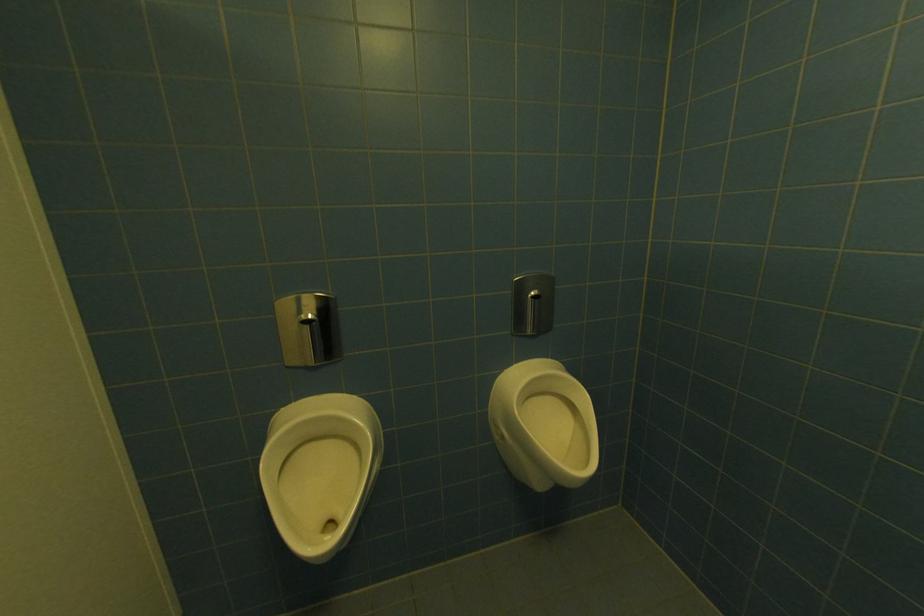
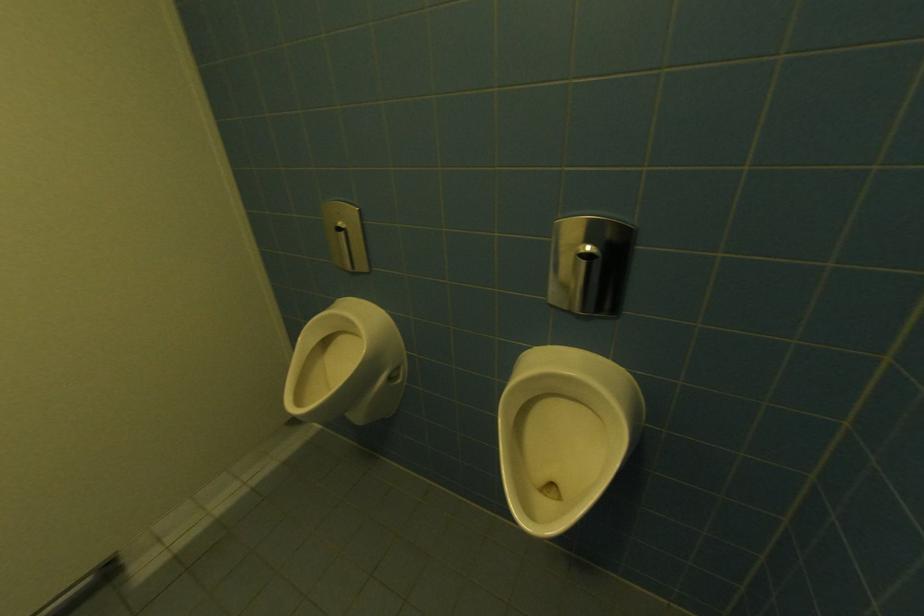
Based on the continuous images, in which direction is the camera rotating?

The camera's rotation is toward left-down.